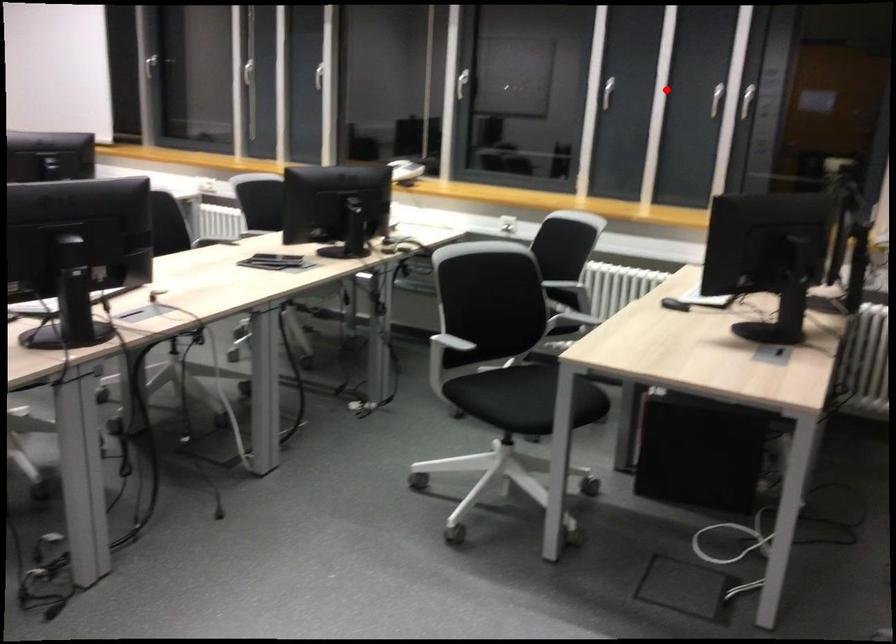
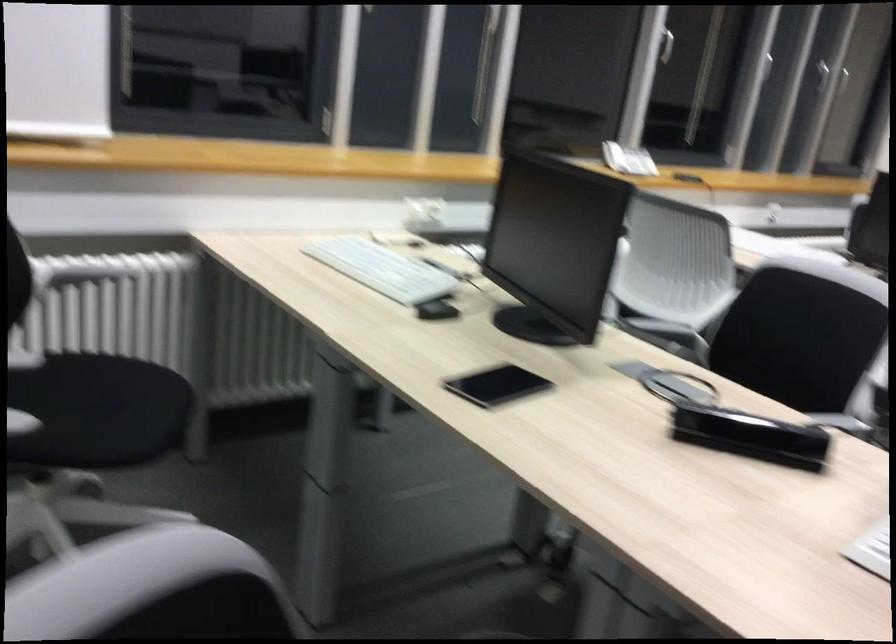
Where in the second image is the point corresponding to the highlighted location from the first image?

(821, 76)